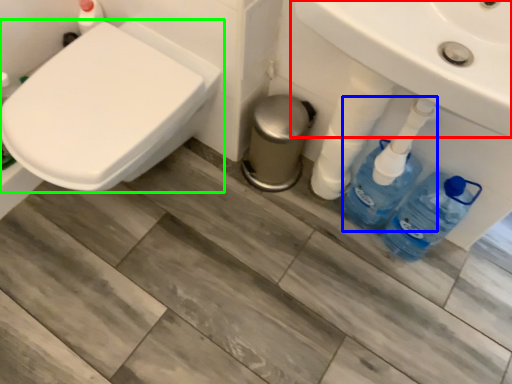
Question: Based on their relative distances, which object is farther from sink (highlighted by a red box)? Choose from cleaning product (highlighted by a blue box) and toilet (highlighted by a green box).

Choices:
 (A) cleaning product
 (B) toilet

Answer: (B)